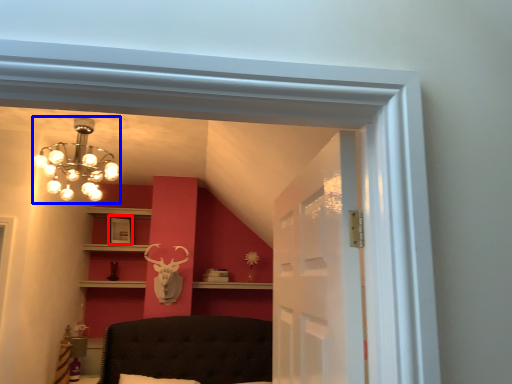
Question: Which object appears farthest to the camera in this image, picture frame (highlighted by a red box) or lamp (highlighted by a blue box)?

Choices:
 (A) picture frame
 (B) lamp

Answer: (A)